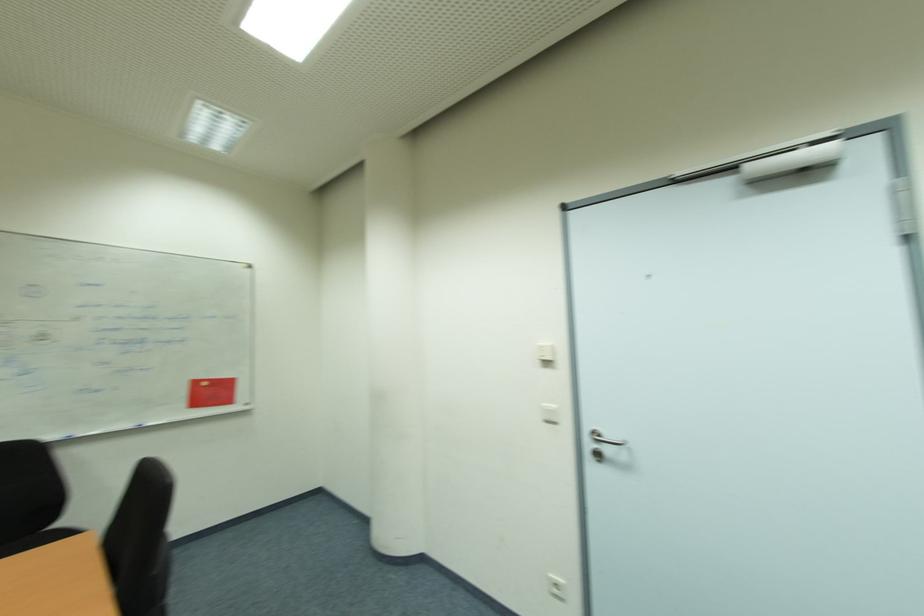
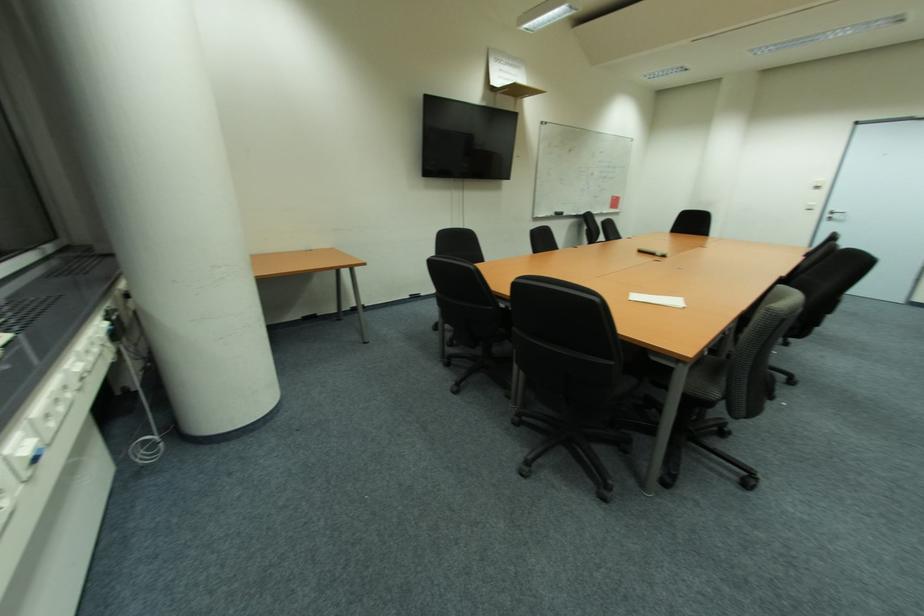
In the second image, find the point that corresponds to point 542,363 in the first image.

(820, 188)